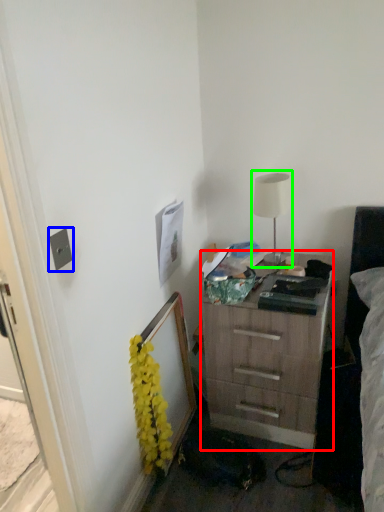
Question: Estimate the real-world distances between objects in this image. Which object is closer to chest of drawers (highlighted by a red box), electric outlet (highlighted by a blue box) or table lamp (highlighted by a green box)?

Choices:
 (A) electric outlet
 (B) table lamp

Answer: (B)